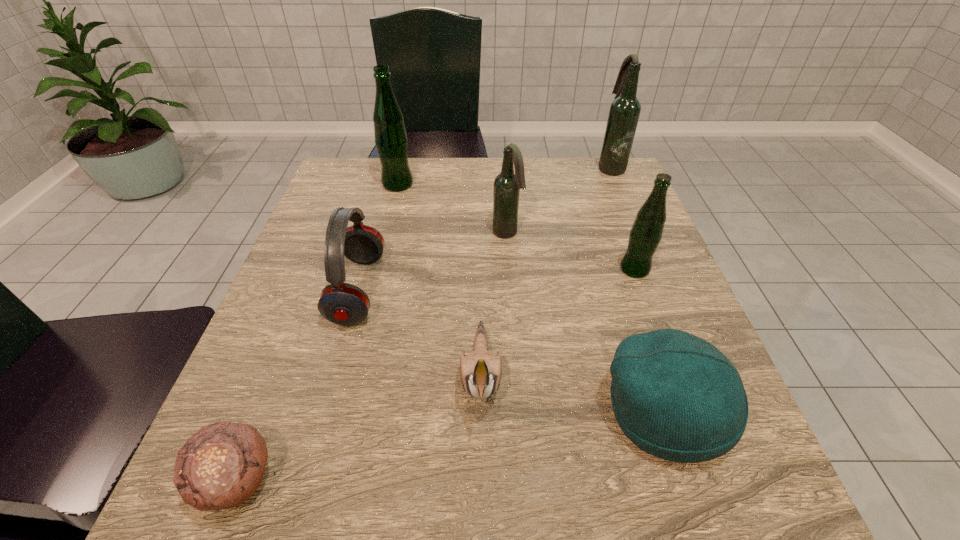
Identify the location of free space between the bird and the farther dark beer bottle. This screenshot has width=960, height=540. (546, 272).

Image resolution: width=960 pixels, height=540 pixels. What are the coordinates of `free spot between the nearer dark beer bottle and the bigger dark beer bottle` in the screenshot? It's located at (559, 200).

Locate an element on the screen. The image size is (960, 540). object identified as the third closest to the leftmost beer bottle is located at coordinates (480, 371).

Point out which object is positioned as the second nearest to the left dark beer bottle. Please provide its 2D coordinates. Your answer should be formatted as a tuple, i.e. [(x, y)], where the tuple contains the x and y coordinates of a point satisfying the conditions above.

[(341, 303)]

Choose which beer bottle is the nearest neighbor to the bird. Please provide its 2D coordinates. Your answer should be formatted as a tuple, i.e. [(x, y)], where the tuple contains the x and y coordinates of a point satisfying the conditions above.

[(507, 185)]

The image size is (960, 540). I want to click on beer bottle object that ranks as the fourth closest to the beanie, so click(391, 140).

I want to click on vacant area in the image that satisfies the following two spatial constraints: 1. at the face of the beanie; 2. on the left side of the bird, so click(481, 411).

The image size is (960, 540). In order to click on free space in the image that satisfies the following two spatial constraints: 1. on the back side of the shortest object; 2. on the left side of the farther green beer bottle in this screenshot , I will do click(351, 184).

Locate an element on the screen. Image resolution: width=960 pixels, height=540 pixels. free space that satisfies the following two spatial constraints: 1. at the face of the beanie; 2. on the right side of the bird is located at coordinates (481, 411).